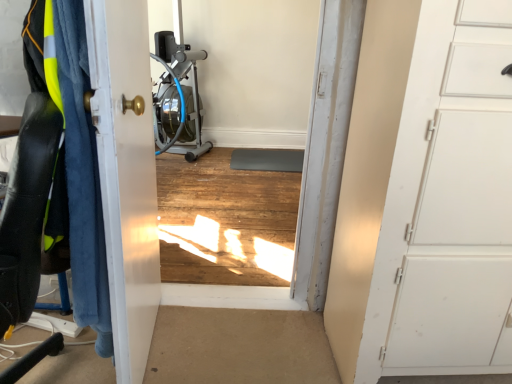
Where is `unoccupied region to the right of white glossy door at left, which appears as the 1th door when viewed from the left`? unoccupied region to the right of white glossy door at left, which appears as the 1th door when viewed from the left is located at coordinates (221, 339).